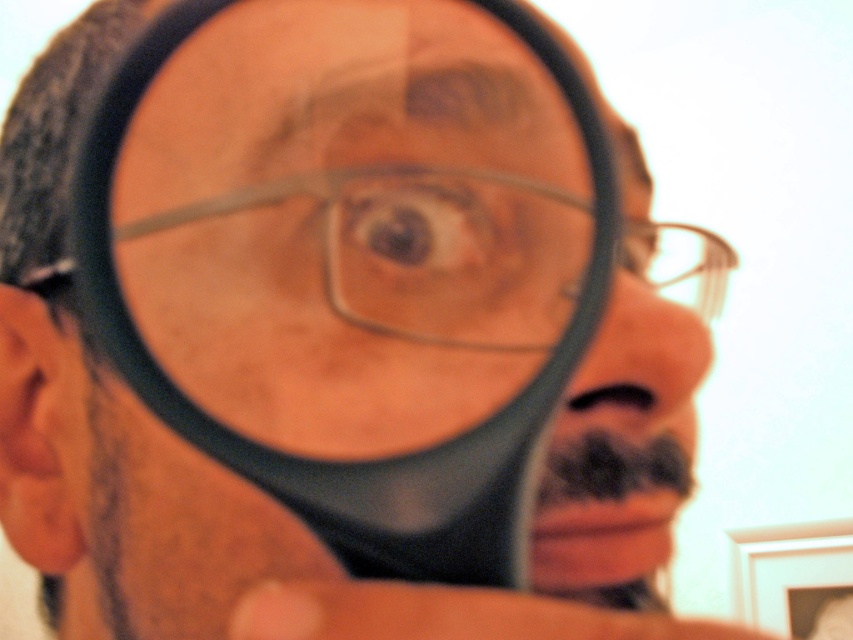
Question: Can you confirm if clear plastic magnifying glass at center is bigger than clear plastic glasses at center?

Choices:
 (A) yes
 (B) no

Answer: (B)

Question: Which of the following is the closest to the observer?

Choices:
 (A) (671, 278)
 (B) (590, 298)

Answer: (B)

Question: Does clear plastic magnifying glass at center have a larger size compared to clear plastic glasses at center?

Choices:
 (A) yes
 (B) no

Answer: (B)

Question: Is clear plastic magnifying glass at center positioned at the back of clear plastic glasses at center?

Choices:
 (A) no
 (B) yes

Answer: (A)

Question: Which of the following is the farthest from the observer?

Choices:
 (A) clear plastic glasses at center
 (B) clear plastic magnifying glass at center

Answer: (A)